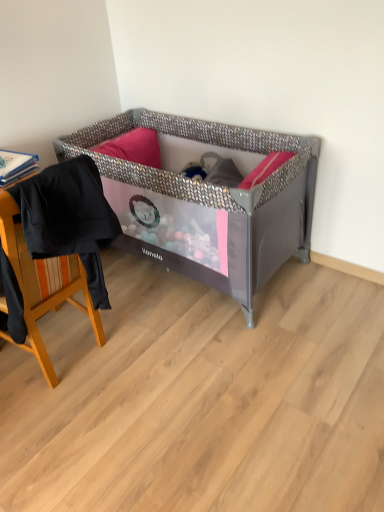
Question: Is black fabric chair at left in front of or behind metallic gray playpen at center in the image?

Choices:
 (A) front
 (B) behind

Answer: (A)

Question: From a real-world perspective, is black fabric chair at left positioned above or below metallic gray playpen at center?

Choices:
 (A) below
 (B) above

Answer: (B)

Question: From their relative heights in the image, would you say black fabric chair at left is taller or shorter than metallic gray playpen at center?

Choices:
 (A) short
 (B) tall

Answer: (A)

Question: Is metallic gray playpen at center wider or thinner than black fabric chair at left?

Choices:
 (A) wide
 (B) thin

Answer: (A)

Question: From a real-world perspective, is metallic gray playpen at center positioned above or below black fabric chair at left?

Choices:
 (A) below
 (B) above

Answer: (A)

Question: Considering the positions of metallic gray playpen at center and black fabric chair at left in the image, is metallic gray playpen at center taller or shorter than black fabric chair at left?

Choices:
 (A) tall
 (B) short

Answer: (A)

Question: Visually, is metallic gray playpen at center positioned to the left or to the right of black fabric chair at left?

Choices:
 (A) right
 (B) left

Answer: (A)